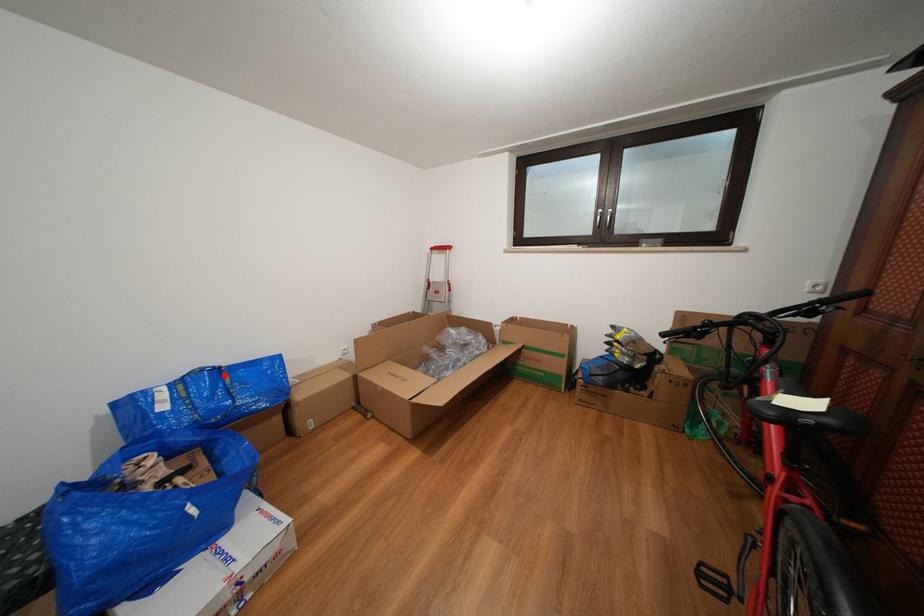
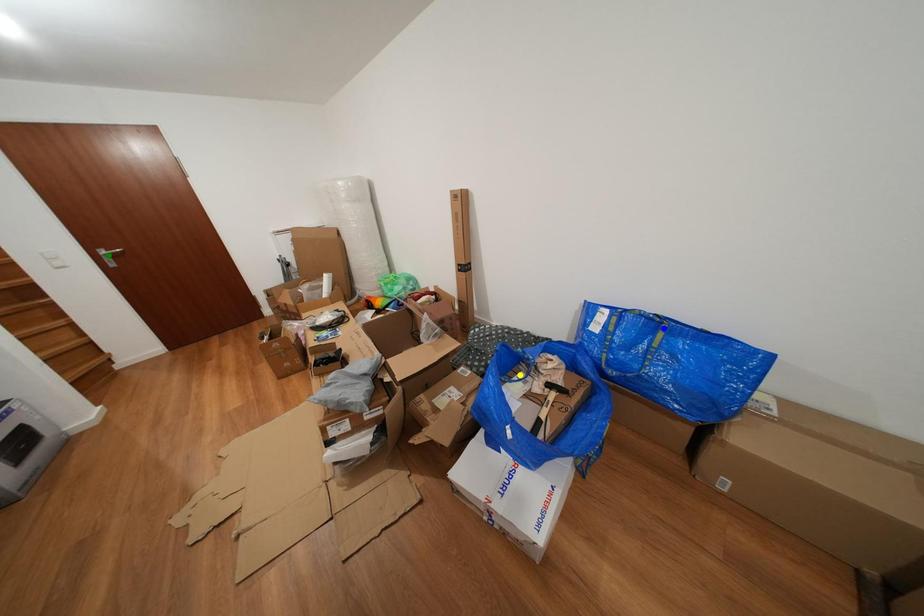
Question: I am providing you with two images of the same scene from different viewpoints. A red point is marked on the first image. You are given multiple points on the second image. Which point in image 2 is actually the same real-world point as the red point in image 1?

Choices:
 (A) green point
 (B) blue point
 (C) yellow point

Answer: (B)